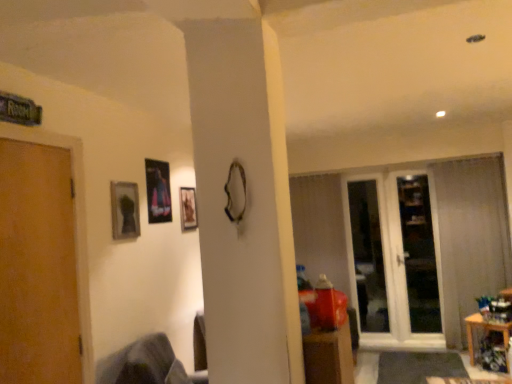
At what (x,y) coordinates should I click in order to perform the action: click on blank space situated above wooden door at left (from a real-world perspective). Please return your answer as a coordinate pair (x, y). The width and height of the screenshot is (512, 384). Looking at the image, I should click on (33, 140).